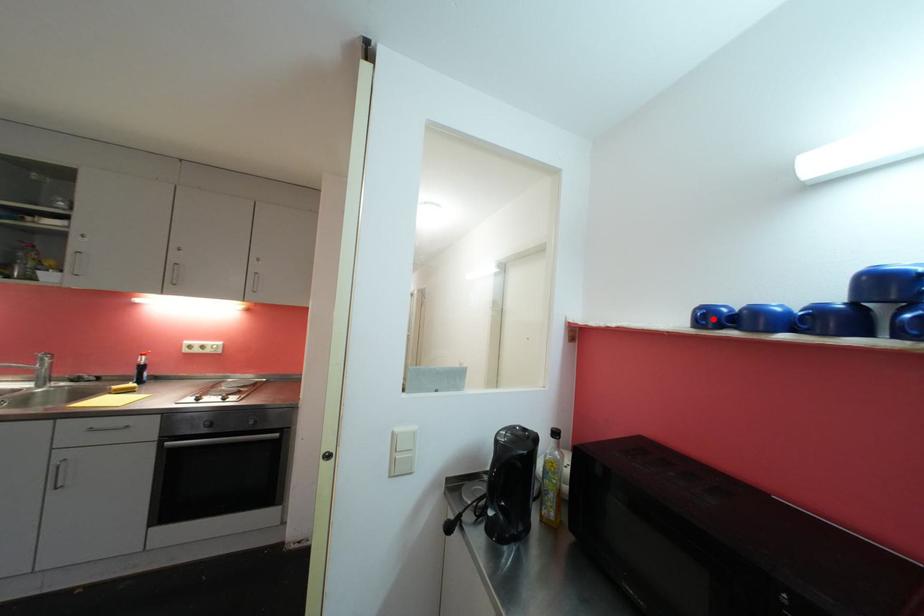
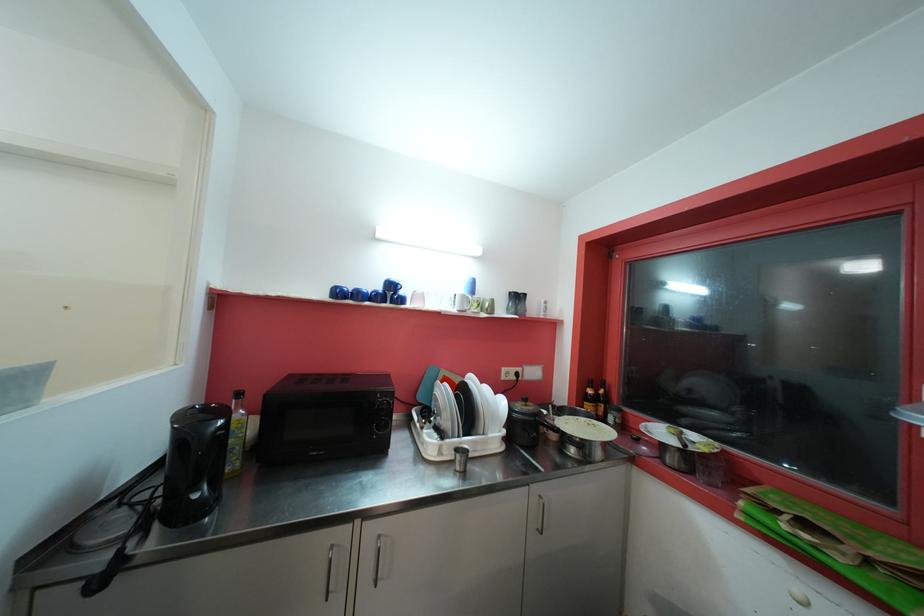
The point at the highlighted location is marked in the first image. Where is the corresponding point in the second image?

(343, 294)